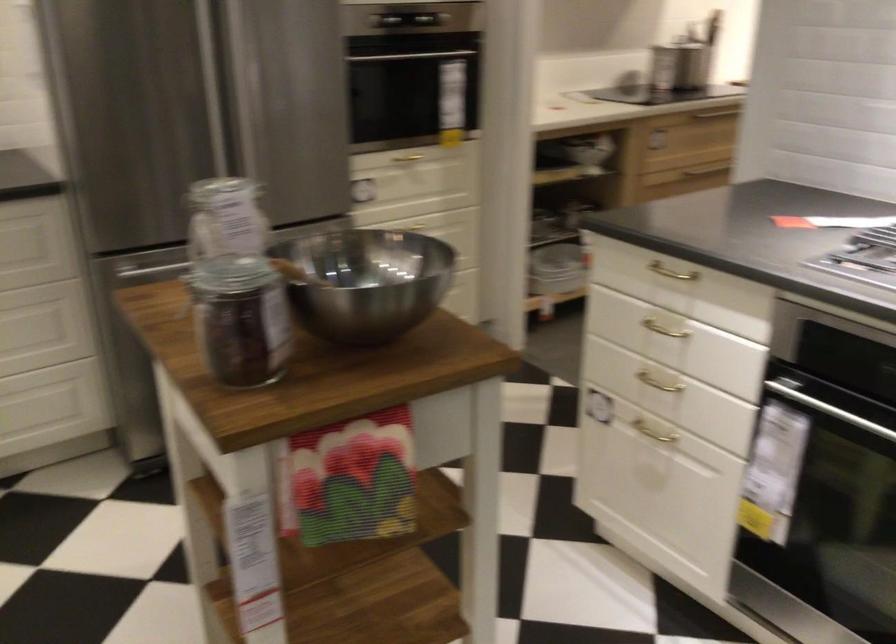
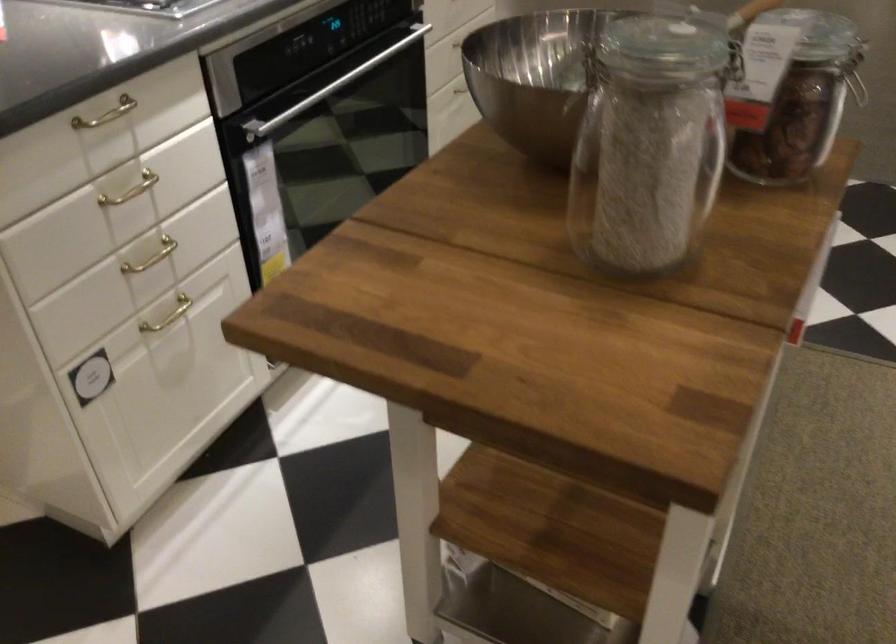
The point at (643,373) is marked in the first image. Where is the corresponding point in the second image?

(151, 257)